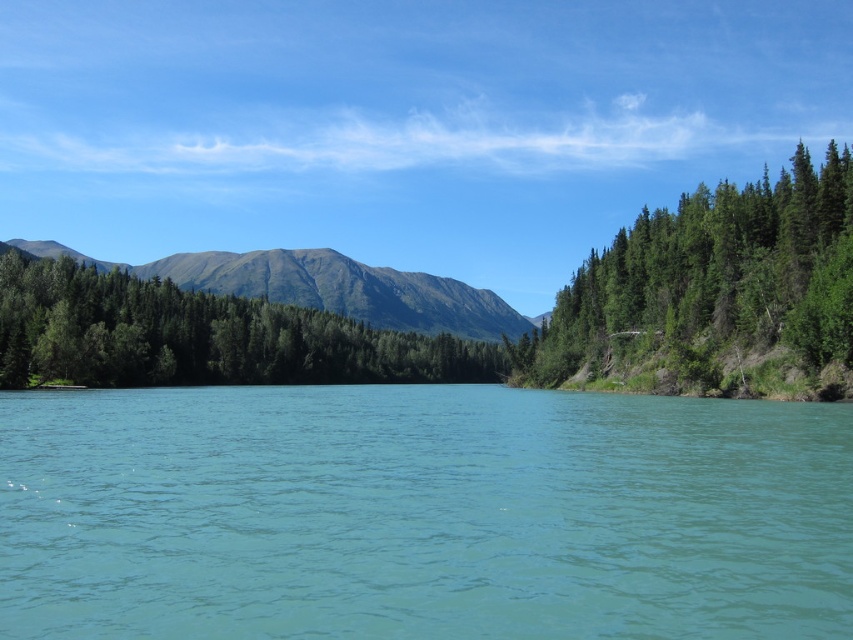
Between point (430, 586) and point (230, 312), which one is positioned behind?

Point (230, 312)

Is turquoise liquid at center below green textured trees at center?

Yes.

Where is `turquoise liquid at center`? Image resolution: width=853 pixels, height=640 pixels. turquoise liquid at center is located at coordinates (421, 513).

Who is more distant from viewer, [213,618] or [572,280]?

The point [572,280] is more distant.

Who is more forward, (691,556) or (798,184)?

Point (691,556)

I want to click on turquoise liquid at center, so click(x=421, y=513).

Where is `turquoise liquid at center`? This screenshot has height=640, width=853. turquoise liquid at center is located at coordinates (421, 513).

Is green textured trees at right taller than green textured trees at center?

No.

Does green textured trees at right appear on the right side of green textured trees at center?

Yes, green textured trees at right is to the right of green textured trees at center.

Where is `green textured trees at right`? The image size is (853, 640). green textured trees at right is located at coordinates click(x=714, y=296).

I want to click on green textured trees at right, so click(x=714, y=296).